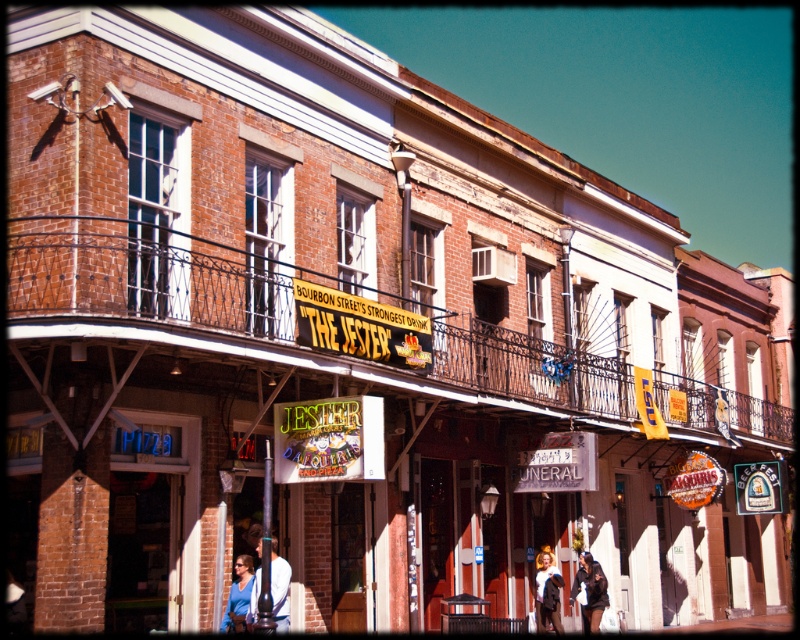
Can you confirm if brown wrought iron balcony at center is taller than white cotton shirt at center?

Indeed, brown wrought iron balcony at center has a greater height compared to white cotton shirt at center.

Who is more forward, (28,262) or (556,634)?

Positioned in front is point (28,262).

Is point (168, 296) in front of point (537, 611)?

Yes, it is in front of point (537, 611).

Identify the location of brown wrought iron balcony at center. This screenshot has width=800, height=640. (150, 276).

In the scene shown: Can you confirm if brown wrought iron balcony at center is thinner than black leather jacket at lower center?

Incorrect, brown wrought iron balcony at center's width is not less than black leather jacket at lower center's.

You are a GUI agent. You are given a task and a screenshot of the screen. Output one action in this format:
    pyautogui.click(x=<x>, y=<y>)
    Task: Click on the brown wrought iron balcony at center
    The height and width of the screenshot is (640, 800).
    Given the screenshot: What is the action you would take?
    pyautogui.click(x=150, y=276)

Is black leather jacket at lower center further to the viewer compared to white cotton shirt at center?

No, it is in front of white cotton shirt at center.

Is point (605, 580) positioned in front of point (541, 560)?

Yes, it is.

Where is `black leather jacket at lower center`? black leather jacket at lower center is located at coordinates (590, 592).